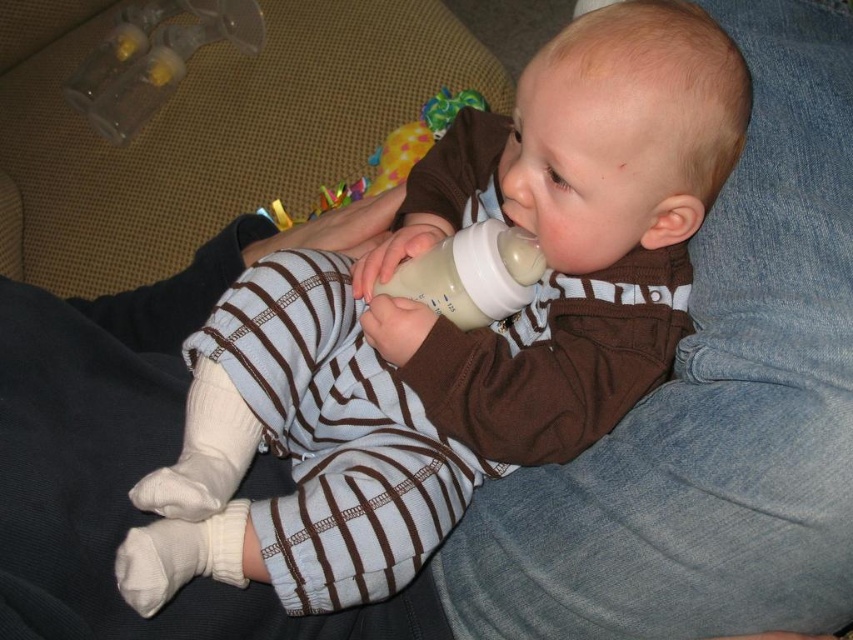
Question: Which object is farther from the camera taking this photo?

Choices:
 (A) blue striped onesie at center
 (B) white plastic baby bottle at center

Answer: (B)

Question: Which object is the farthest from the white plastic baby bottle at center?

Choices:
 (A) plastic colorful rattle at center
 (B) transparent plastic bottle at upper left
 (C) blue striped onesie at center

Answer: (B)

Question: Is white plastic baby bottle at center positioned before plastic colorful rattle at center?

Choices:
 (A) no
 (B) yes

Answer: (B)

Question: Where is white plastic baby bottle at center located in relation to plastic colorful rattle at center in the image?

Choices:
 (A) above
 (B) below

Answer: (B)

Question: Which point is farther to the camera?

Choices:
 (A) transparent plastic bottle at upper left
 (B) plastic colorful rattle at center
 (C) blue striped onesie at center

Answer: (A)

Question: Does blue striped onesie at center have a lesser width compared to transparent plastic bottle at upper left?

Choices:
 (A) yes
 (B) no

Answer: (B)